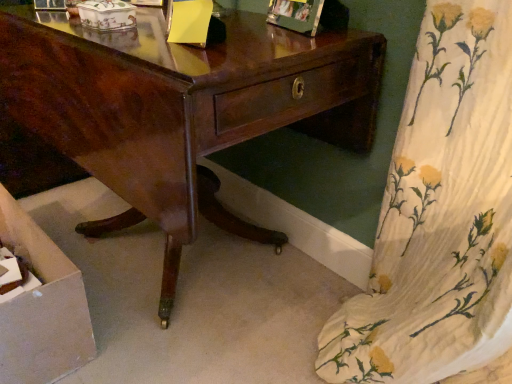
Image resolution: width=512 pixels, height=384 pixels. What are the coordinates of `vacant space underneath glossy wood desk at center (from a real-world perspective)` in the screenshot? It's located at (188, 266).